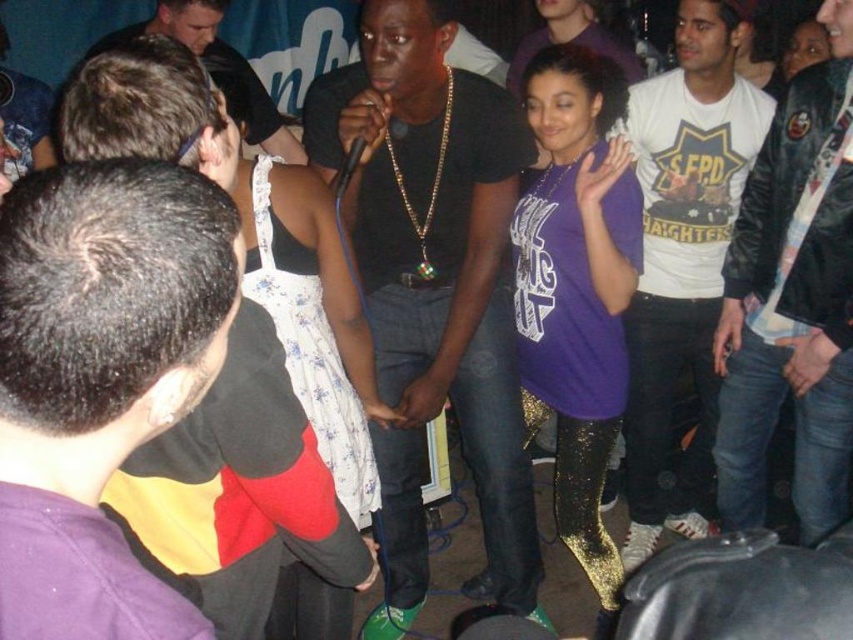
From the picture: Does black matte shirt at center come behind matte black shirt at upper left?

No, it is not.

Looking at this image, who is positioned more to the left, black matte shirt at center or matte black shirt at upper left?

From the viewer's perspective, matte black shirt at upper left appears more on the left side.

Image resolution: width=853 pixels, height=640 pixels. Identify the location of black matte shirt at center. (434, 280).

Who is more forward, (689, 10) or (254, 112)?

Point (689, 10)

Which is in front, point (726, 49) or point (198, 45)?

Point (726, 49) is in front.

Locate an element on the screen. The image size is (853, 640). white cotton t-shirt at upper right is located at coordinates (682, 257).

Does black leather jacket at right come in front of white cotton t-shirt at upper right?

Yes, black leather jacket at right is in front of white cotton t-shirt at upper right.

Describe the element at coordinates (792, 301) in the screenshot. This screenshot has width=853, height=640. I see `black leather jacket at right` at that location.

Is point (750, 454) closer to camera compared to point (630, 125)?

Yes, it is.

Where is `black leather jacket at right`? The image size is (853, 640). black leather jacket at right is located at coordinates (792, 301).